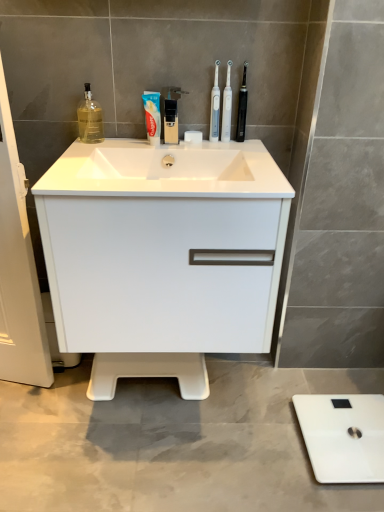
Question: Is white glossy toothbrush at upper center, the 2th toothbrush from the left, in front of or behind white matte scale at lower right in the image?

Choices:
 (A) front
 (B) behind

Answer: (B)

Question: In the image, is white glossy toothbrush at upper center, the 2th toothbrush from the left, on the left side or the right side of white matte scale at lower right?

Choices:
 (A) left
 (B) right

Answer: (A)

Question: Estimate the real-world distances between objects in this image. Which object is farther from the black plastic faucet at upper center?

Choices:
 (A) white matte scale at lower right
 (B) white glossy toothbrush at upper center, the 2th toothbrush from the left
 (C) black plastic toothbrush at upper center, the third toothbrush in the left-to-right sequence
 (D) clear glass bottle at upper left
 (E) white plastic toothbrush at upper center, which is the third toothbrush from right to left

Answer: (A)

Question: Which object is positioned farthest from the black plastic faucet at upper center?

Choices:
 (A) clear glass bottle at upper left
 (B) white glossy sink at center
 (C) white matte scale at lower right
 (D) white plastic toothbrush at upper center, placed as the first toothbrush when sorted from left to right
 (E) blue glossy toothpaste at center

Answer: (C)